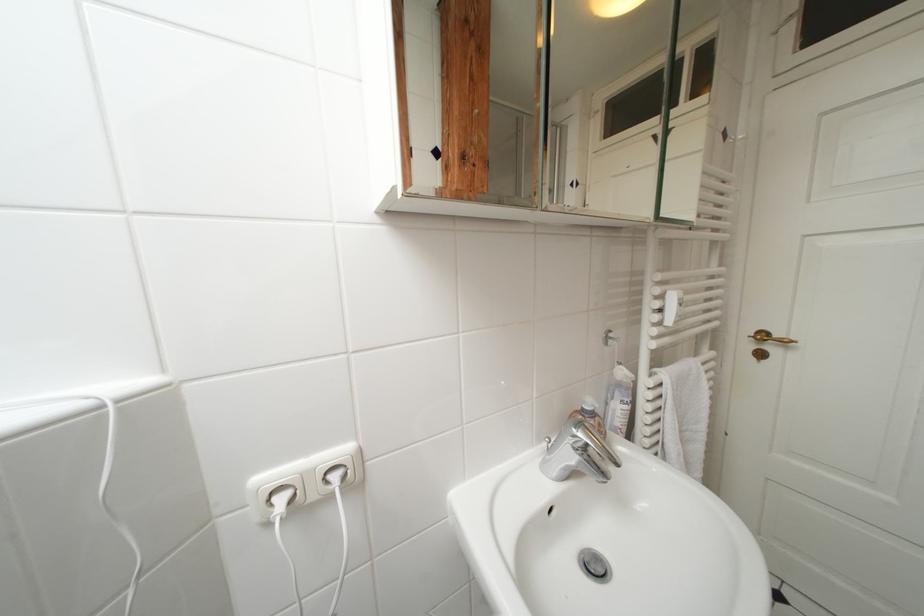
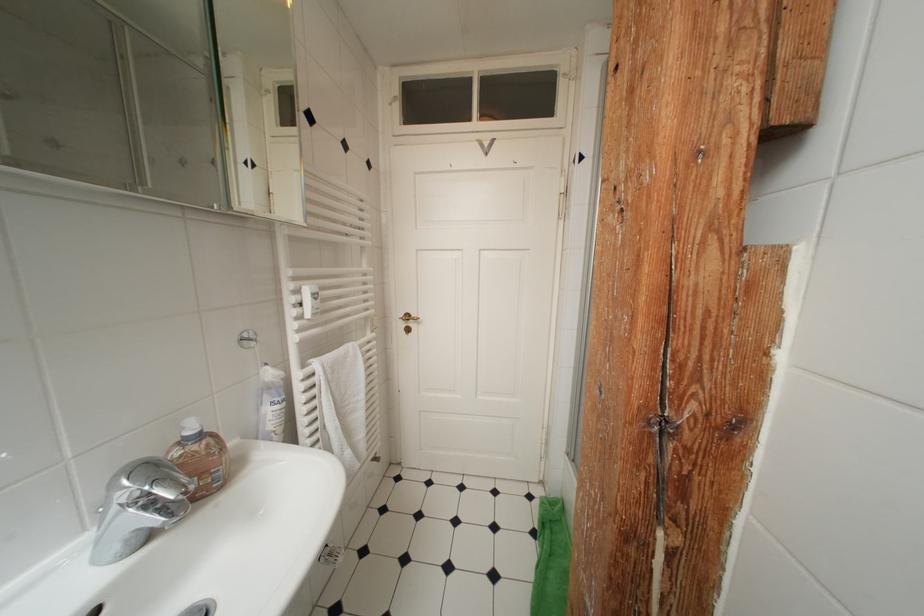
Where in the second image is the point corresponding to (627,367) from the first image?

(274, 368)